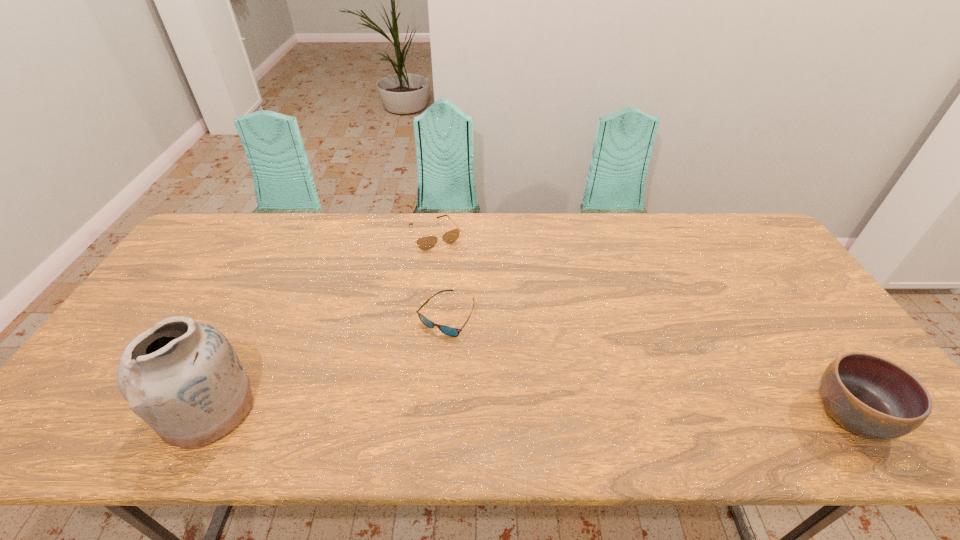
I want to click on free space located 0.240m on the front-facing side of the farthest object, so click(x=472, y=299).

Find the location of a particular element. This screenshot has height=540, width=960. vacant region located on the front-facing side of the farthest object is located at coordinates (453, 265).

The image size is (960, 540). I want to click on vacant space located at the front of the shortest object showing the lenses, so click(x=450, y=361).

Locate an element on the screen. blank space located 0.140m at the front of the shortest object showing the lenses is located at coordinates (452, 384).

Locate an element on the screen. free spot located 0.200m at the front of the shortest object showing the lenses is located at coordinates (454, 407).

Where is `object at the far edge`? This screenshot has height=540, width=960. object at the far edge is located at coordinates (424, 243).

Image resolution: width=960 pixels, height=540 pixels. I want to click on pottery that is at the near edge, so click(x=183, y=378).

Where is `bowl that is positioned at the near edge`? bowl that is positioned at the near edge is located at coordinates (866, 394).

Where is `object located at the right edge`? Image resolution: width=960 pixels, height=540 pixels. object located at the right edge is located at coordinates (866, 394).

Find the location of a particular element. The image size is (960, 540). object situated at the near right corner is located at coordinates (866, 394).